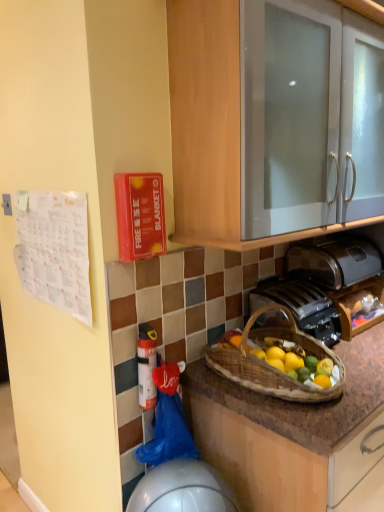
Question: Is metallic silver toaster at lower center turned away from white plastic extinguisher at lower center?

Choices:
 (A) yes
 (B) no

Answer: (B)

Question: Does metallic silver toaster at lower center have a greater width compared to white plastic extinguisher at lower center?

Choices:
 (A) no
 (B) yes

Answer: (B)

Question: From the image's perspective, does metallic silver toaster at lower center appear higher than white plastic extinguisher at lower center?

Choices:
 (A) yes
 (B) no

Answer: (A)

Question: Considering the relative sizes of metallic silver toaster at lower center and white plastic extinguisher at lower center in the image provided, is metallic silver toaster at lower center bigger than white plastic extinguisher at lower center?

Choices:
 (A) no
 (B) yes

Answer: (B)

Question: Is metallic silver toaster at lower center thinner than white plastic extinguisher at lower center?

Choices:
 (A) no
 (B) yes

Answer: (A)

Question: From a real-world perspective, does metallic silver toaster at lower center stand above white plastic extinguisher at lower center?

Choices:
 (A) no
 (B) yes

Answer: (B)

Question: Is white glossy cabinet at upper center positioned with its back to satin silver toaster at lower right?

Choices:
 (A) yes
 (B) no

Answer: (B)

Question: Can you confirm if white glossy cabinet at upper center is thinner than satin silver toaster at lower right?

Choices:
 (A) yes
 (B) no

Answer: (B)

Question: Can you confirm if white glossy cabinet at upper center is positioned to the left of satin silver toaster at lower right?

Choices:
 (A) no
 (B) yes

Answer: (B)

Question: From the image's perspective, is white glossy cabinet at upper center on satin silver toaster at lower right?

Choices:
 (A) no
 (B) yes

Answer: (B)

Question: Is white glossy cabinet at upper center behind satin silver toaster at lower right?

Choices:
 (A) no
 (B) yes

Answer: (A)

Question: Can you confirm if white glossy cabinet at upper center is taller than satin silver toaster at lower right?

Choices:
 (A) yes
 (B) no

Answer: (A)

Question: Does brown woven picnic basket at lower center appear on the right side of metallic silver toaster at lower center?

Choices:
 (A) yes
 (B) no

Answer: (B)